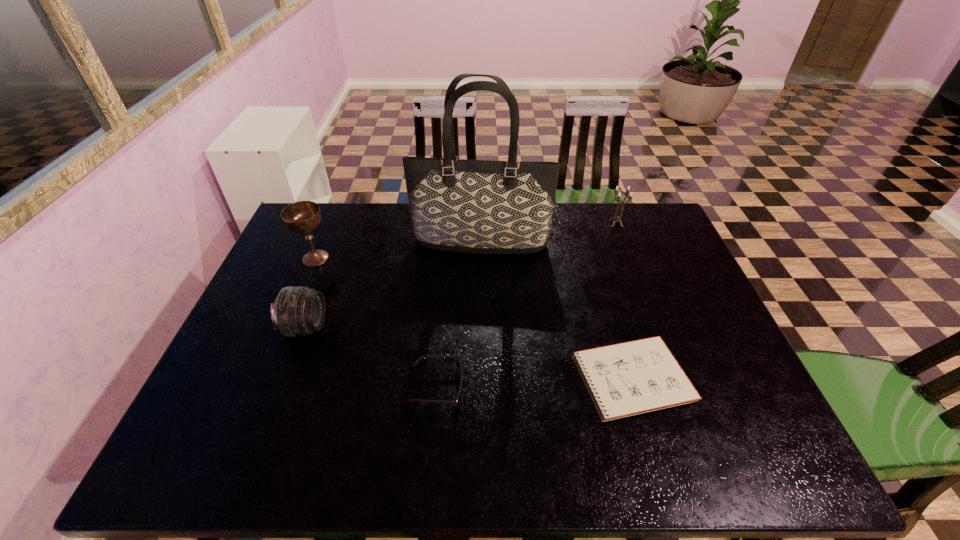
This screenshot has width=960, height=540. In the image, there is a desktop. In order to click on vacant space at the near edge in this screenshot , I will do `click(581, 436)`.

In the image, there is a desktop. Find the location of `free space at the left edge`. free space at the left edge is located at coordinates (268, 345).

Find the location of a particular element. blank space at the far right corner of the desktop is located at coordinates (651, 210).

The height and width of the screenshot is (540, 960). Identify the location of free area in between the fifth tallest object and the tote bag. (459, 315).

What are the coordinates of `free space between the telephoto lens and the tote bag` in the screenshot? It's located at (393, 285).

At what (x,y) coordinates should I click in order to perform the action: click on free point between the telephoto lens and the sunglasses. Please return your answer as a coordinate pair (x, y). Looking at the image, I should click on (372, 357).

I want to click on vacant area that lies between the shortest object and the chalice, so click(x=472, y=319).

Identify the location of unoccupied position between the tote bag and the fifth shortest object. (398, 251).

Where is `unoccupied position between the telephoto lens and the tote bag`? This screenshot has height=540, width=960. unoccupied position between the telephoto lens and the tote bag is located at coordinates (393, 285).

At what (x,y) coordinates should I click in order to perform the action: click on free space between the tote bag and the sunglasses. Please return your answer as a coordinate pair (x, y). This screenshot has height=540, width=960. Looking at the image, I should click on (459, 315).